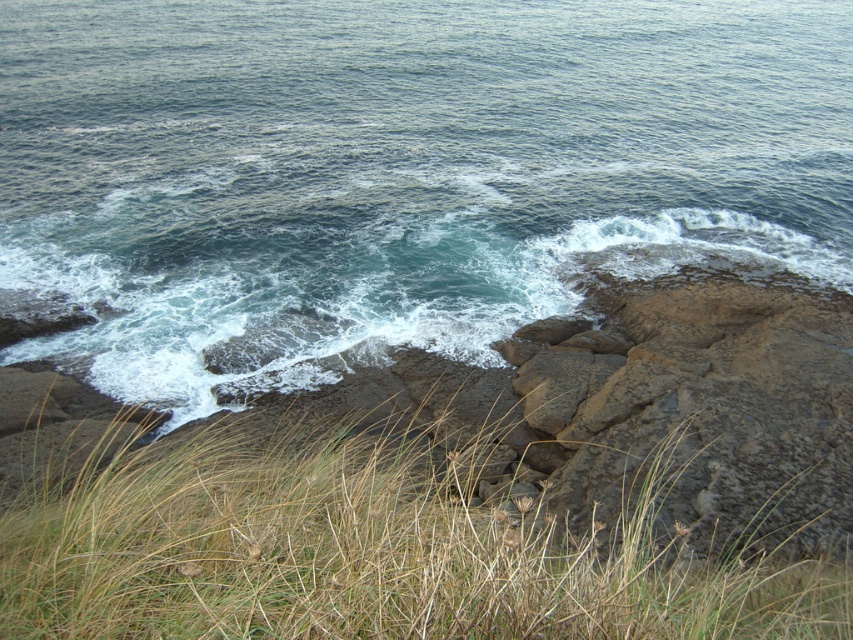
This screenshot has height=640, width=853. What do you see at coordinates (397, 170) in the screenshot?
I see `blue water at center` at bounding box center [397, 170].

Between blue water at center and brown grass at lower center, which one has more height?

With more height is blue water at center.

What do you see at coordinates (397, 170) in the screenshot? This screenshot has height=640, width=853. I see `blue water at center` at bounding box center [397, 170].

The image size is (853, 640). I want to click on blue water at center, so click(397, 170).